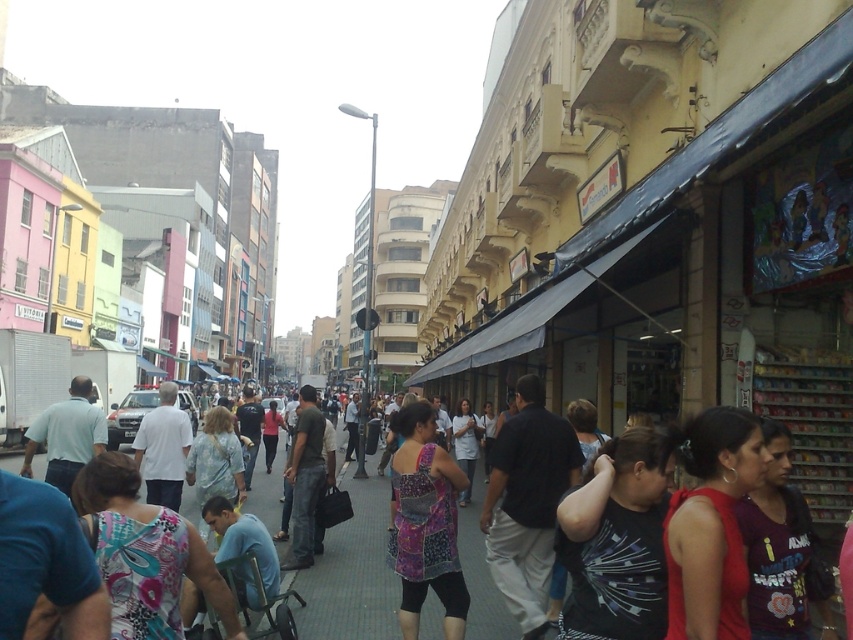
Does red fabric shirt at lower right come behind dark gray fabric shirt at center?

No, it is in front of dark gray fabric shirt at center.

Who is taller, red fabric shirt at lower right or dark gray fabric shirt at center?

dark gray fabric shirt at center is taller.

Which is in front, point (734, 628) or point (556, 484)?

Point (734, 628) is in front.

Where is `red fabric shirt at lower right`? The width and height of the screenshot is (853, 640). red fabric shirt at lower right is located at coordinates (711, 525).

Looking at this image, does red fabric shirt at lower right have a greater height compared to patchwork fabric dress at center?

Incorrect, red fabric shirt at lower right's height is not larger of patchwork fabric dress at center's.

Between red fabric shirt at lower right and patchwork fabric dress at center, which one is positioned higher?

red fabric shirt at lower right is higher up.

Where is `red fabric shirt at lower right`? The image size is (853, 640). red fabric shirt at lower right is located at coordinates (711, 525).

Can you confirm if printed fabric shirt at center is smaller than patchwork fabric dress at center?

Yes, printed fabric shirt at center is smaller than patchwork fabric dress at center.

Does printed fabric shirt at center have a larger size compared to patchwork fabric dress at center?

Actually, printed fabric shirt at center might be smaller than patchwork fabric dress at center.

I want to click on printed fabric shirt at center, so click(616, 540).

Where is `printed fabric shirt at center`? This screenshot has width=853, height=640. printed fabric shirt at center is located at coordinates (616, 540).